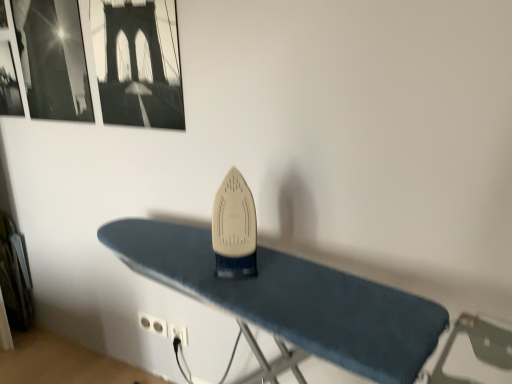
Question: In which direction should I rotate to look at white plastic plug at lower center, marked as the 1th plug in a left-to-right arrangement?

Choices:
 (A) left
 (B) right

Answer: (A)

Question: Does white plastic plug at lower center, marked as the 1th plug in a left-to-right arrangement, have a lesser width compared to black glossy picture frame at upper left, the first picture frame when ordered from left to right?

Choices:
 (A) yes
 (B) no

Answer: (A)

Question: Is white plastic plug at lower center, marked as the 1th plug in a left-to-right arrangement, further to the viewer compared to black glossy picture frame at upper left, arranged as the 2th picture frame when viewed from the right?

Choices:
 (A) no
 (B) yes

Answer: (B)

Question: Is white plastic plug at lower center, the 2th plug viewed from the right, closer to the viewer compared to black glossy picture frame at upper left, the first picture frame when ordered from left to right?

Choices:
 (A) no
 (B) yes

Answer: (A)

Question: Considering the relative sizes of white plastic plug at lower center, the 2th plug viewed from the right, and black glossy picture frame at upper left, arranged as the 2th picture frame when viewed from the right, in the image provided, is white plastic plug at lower center, the 2th plug viewed from the right, taller than black glossy picture frame at upper left, arranged as the 2th picture frame when viewed from the right,?

Choices:
 (A) yes
 (B) no

Answer: (B)

Question: Is white plastic plug at lower center, marked as the 1th plug in a left-to-right arrangement, looking in the opposite direction of black glossy picture frame at upper left, arranged as the 2th picture frame when viewed from the right?

Choices:
 (A) no
 (B) yes

Answer: (A)

Question: Can you confirm if white plastic plug at lower center, marked as the 1th plug in a left-to-right arrangement, is smaller than black glossy picture frame at upper left, the first picture frame when ordered from left to right?

Choices:
 (A) no
 (B) yes

Answer: (B)

Question: Is black plastic plug at lower center, which is the first plug in right-to-left order, thinner than blue fabric ironing board at center?

Choices:
 (A) no
 (B) yes

Answer: (B)

Question: Does black plastic plug at lower center, which is the first plug in right-to-left order, come in front of blue fabric ironing board at center?

Choices:
 (A) no
 (B) yes

Answer: (A)

Question: Can you confirm if black plastic plug at lower center, which is the first plug in right-to-left order, is shorter than blue fabric ironing board at center?

Choices:
 (A) no
 (B) yes

Answer: (B)

Question: From the image's perspective, is black plastic plug at lower center, which is the first plug in right-to-left order, on blue fabric ironing board at center?

Choices:
 (A) no
 (B) yes

Answer: (B)

Question: Can you confirm if black plastic plug at lower center, which is the first plug in right-to-left order, is taller than blue fabric ironing board at center?

Choices:
 (A) no
 (B) yes

Answer: (A)

Question: From a real-world perspective, is black plastic plug at lower center, which is counted as the 2th plug, starting from the left, under blue fabric ironing board at center?

Choices:
 (A) yes
 (B) no

Answer: (A)

Question: From the image's perspective, is blue fabric ironing board at center below black glossy picture frame at upper left, the first picture frame when ordered from left to right?

Choices:
 (A) yes
 (B) no

Answer: (A)